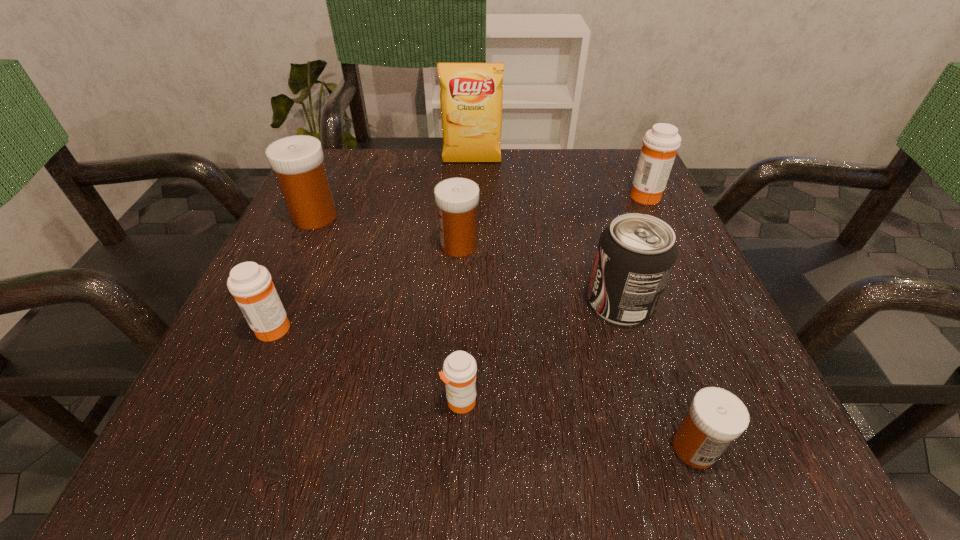
Where is `crisp (potato chip)`? crisp (potato chip) is located at coordinates (471, 96).

Image resolution: width=960 pixels, height=540 pixels. I want to click on the tallest object, so (471, 96).

Where is `the rightmost object`? The height and width of the screenshot is (540, 960). the rightmost object is located at coordinates (660, 144).

Where is `the rightmost medicine`? the rightmost medicine is located at coordinates (660, 144).

Where is `the biggest white medicine`? The height and width of the screenshot is (540, 960). the biggest white medicine is located at coordinates (297, 160).

Image resolution: width=960 pixels, height=540 pixels. Identify the location of the farthest white medicine. (297, 160).

Where is `black soda can`? The height and width of the screenshot is (540, 960). black soda can is located at coordinates (635, 256).

Image resolution: width=960 pixels, height=540 pixels. I want to click on the third nearest medicine, so click(251, 284).

The image size is (960, 540). Find the location of `the leftmost orange medicine`. the leftmost orange medicine is located at coordinates (251, 284).

Find the location of a particular element. Image resolution: width=960 pixels, height=540 pixels. the second biggest white medicine is located at coordinates click(x=457, y=199).